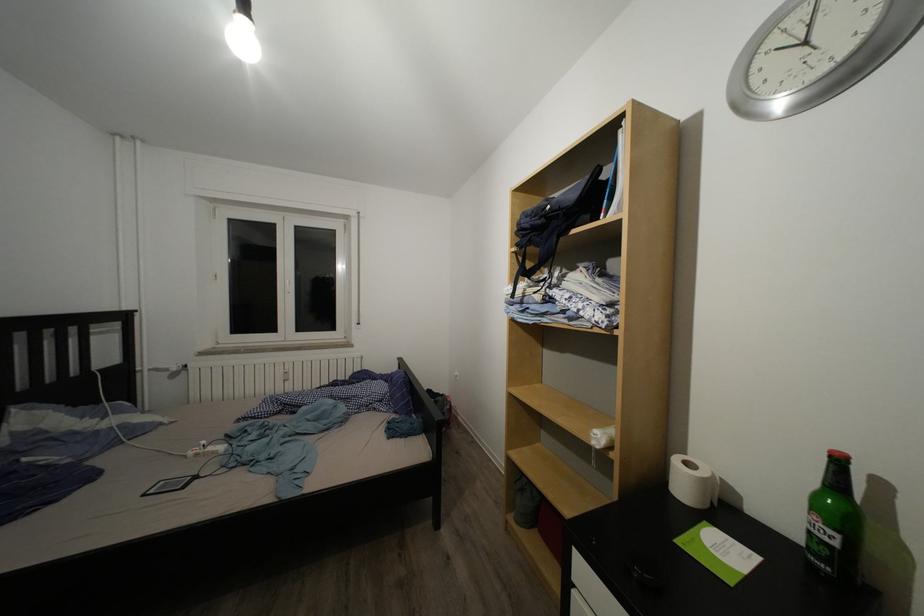
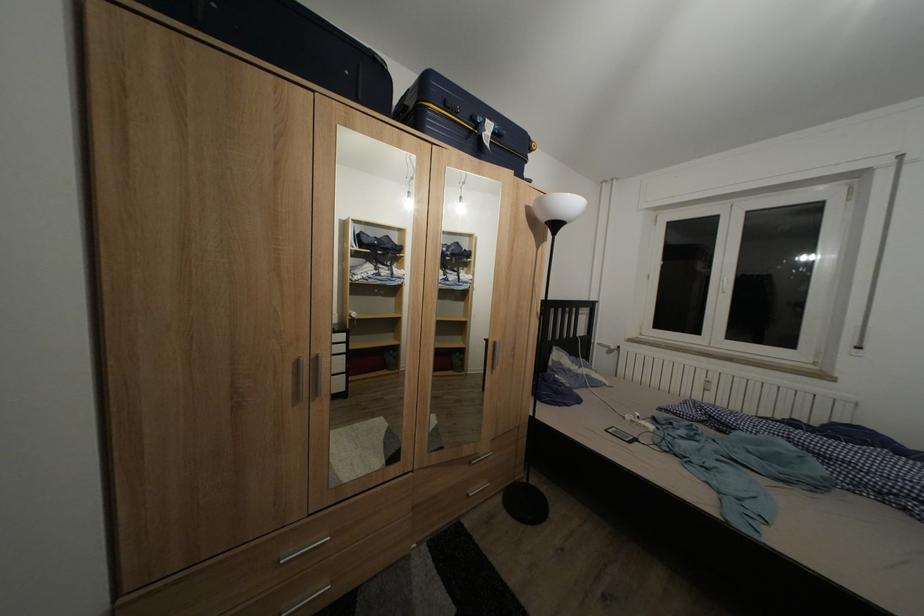
Question: The first image is from the beginning of the video and the second image is from the end. How did the camera likely rotate when shooting the video?

Choices:
 (A) Left
 (B) Right
 (C) Up
 (D) Down

Answer: (A)